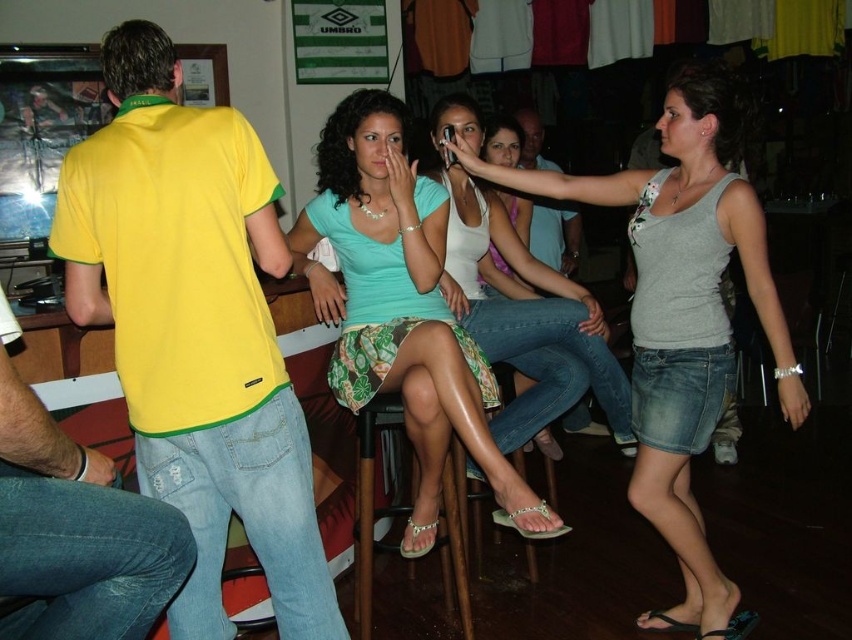
Question: In this image, where is yellow cotton shirt at left located relative to matte white tank top at center?

Choices:
 (A) below
 (B) above

Answer: (A)

Question: Which of the following is the closest to the observer?

Choices:
 (A) (548, 276)
 (B) (441, 560)
 (C) (101, 598)
 (D) (206, 168)

Answer: (C)

Question: Which object is closer to the camera taking this photo?

Choices:
 (A) light green fabric skirt at center
 (B) jeans at left
 (C) gray matte tank top at center
 (D) matte white tank top at center

Answer: (B)

Question: Which object appears farthest from the camera in this image?

Choices:
 (A) matte white tank top at center
 (B) yellow cotton shirt at left
 (C) wooden bar stool at lower center
 (D) light green fabric skirt at center

Answer: (A)

Question: Is jeans at left smaller than wooden bar stool at lower center?

Choices:
 (A) no
 (B) yes

Answer: (B)

Question: Is gray matte tank top at center below jeans at left?

Choices:
 (A) yes
 (B) no

Answer: (B)